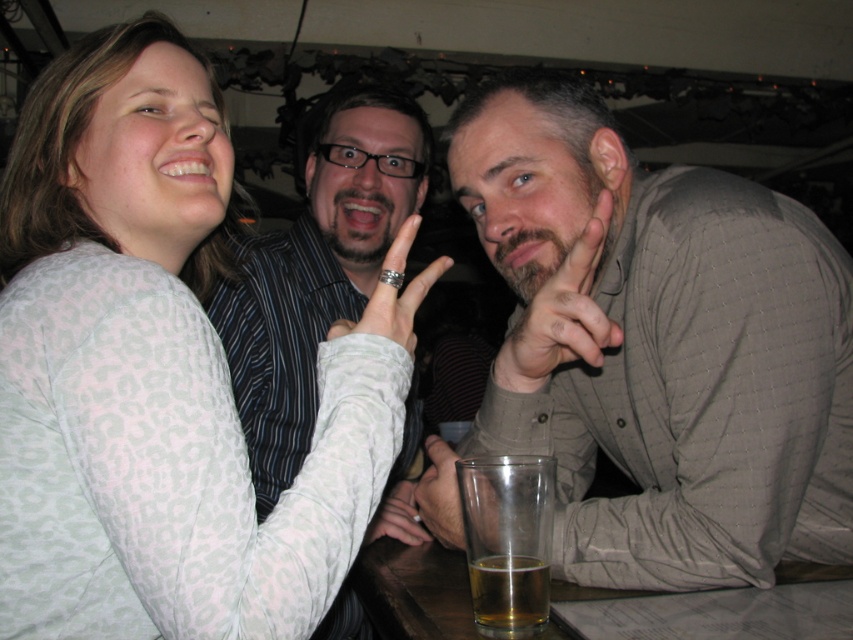
Question: Does matte black ring at center have a lesser width compared to matte glass at lower center?

Choices:
 (A) yes
 (B) no

Answer: (B)

Question: Which object appears farthest from the camera in this image?

Choices:
 (A) beige textured hand at center
 (B) matte gray shirt at center

Answer: (A)

Question: Which of the following is the farthest from the observer?

Choices:
 (A) matte black ring at center
 (B) white leopard print shirt at upper left

Answer: (A)

Question: From the image, what is the correct spatial relationship of golden amber liquid at lower center in relation to matte glass at lower center?

Choices:
 (A) below
 (B) above

Answer: (A)

Question: Which is nearer to the beige textured hand at center?

Choices:
 (A) matte silver ring at center
 (B) matte black ring at center
 (C) striped shirt at center

Answer: (B)

Question: Is white leopard print shirt at upper left positioned before beige textured hand at center?

Choices:
 (A) yes
 (B) no

Answer: (A)